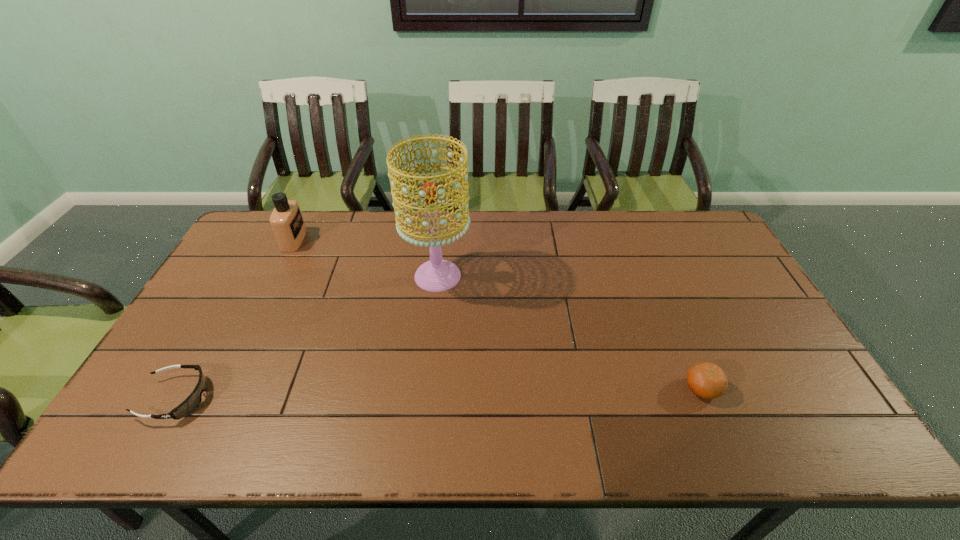
I want to click on empty space between the second shortest object and the perfume, so click(498, 314).

Image resolution: width=960 pixels, height=540 pixels. I want to click on free space between the third nearest object and the rightmost object, so click(x=570, y=332).

The height and width of the screenshot is (540, 960). Identify the location of free space between the lampshade and the goggles. (307, 337).

Find the location of `vacant space in between the clementine and the tallest object`. vacant space in between the clementine and the tallest object is located at coordinates (570, 332).

Find the location of a particular element. object that is the second closest to the shortest object is located at coordinates (437, 275).

Identify which object is located as the third nearest to the tallest object. Please provide its 2D coordinates. Your answer should be formatted as a tuple, i.e. [(x, y)], where the tuple contains the x and y coordinates of a point satisfying the conditions above.

[(707, 380)]

The width and height of the screenshot is (960, 540). Find the location of `free point that satisfies the following two spatial constraints: 1. on the back side of the tallest object; 2. on the front label of the second tallest object`. free point that satisfies the following two spatial constraints: 1. on the back side of the tallest object; 2. on the front label of the second tallest object is located at coordinates (442, 240).

This screenshot has width=960, height=540. What are the coordinates of `vacant space that satisfies the following two spatial constraints: 1. on the front label of the second tallest object; 2. on the left side of the rightmost object` in the screenshot? It's located at click(x=221, y=389).

This screenshot has height=540, width=960. Identify the location of free space that satisfies the following two spatial constraints: 1. on the front label of the third shortest object; 2. on the right side of the clementine. (221, 389).